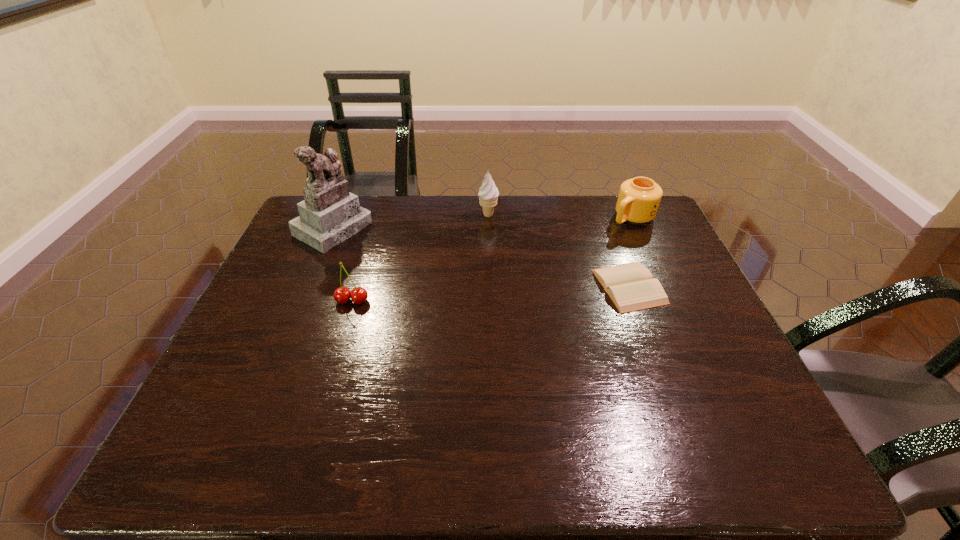
At what (x,y) coordinates should I click in order to perform the action: click on free spot on the desktop that is between the cherry and the diary and is positioned on the front-facing side of the figurine. Please return your answer as a coordinate pair (x, y). Looking at the image, I should click on (456, 295).

Find the location of a particular element. The image size is (960, 540). vacant space on the desktop that is between the cherry and the diary and is positioned on the front-facing side of the third object from left to right is located at coordinates (460, 295).

At what (x,y) coordinates should I click in order to perform the action: click on vacant space on the desktop that is between the cherry and the shortest object and is positioned on the handle side of the mug. Please return your answer as a coordinate pair (x, y). The image size is (960, 540). Looking at the image, I should click on (533, 292).